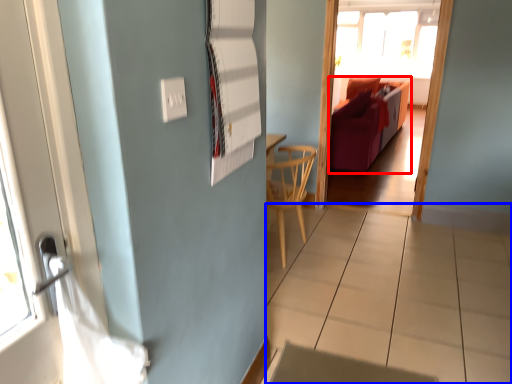
Question: Which of the following is the closest to the observer, furniture (highlighted by a red box) or tile (highlighted by a blue box)?

Choices:
 (A) furniture
 (B) tile

Answer: (B)